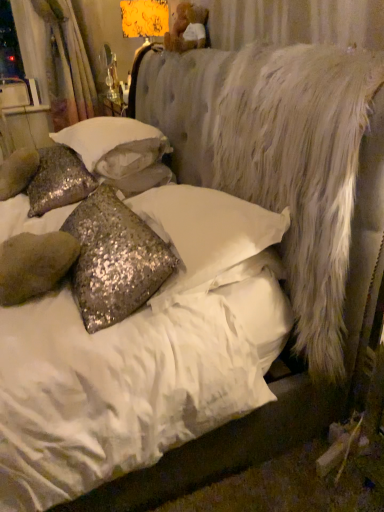
Image resolution: width=384 pixels, height=512 pixels. In order to click on sparkly silver pillow at left, arranged as the third pillow when viewed from the front in this screenshot , I will do `click(58, 180)`.

Locate an element on the screen. The image size is (384, 512). white fluffy mattress at right is located at coordinates (277, 155).

This screenshot has height=512, width=384. What do you see at coordinates (115, 145) in the screenshot?
I see `white sequined pillow at center, which is the second pillow in back-to-front order` at bounding box center [115, 145].

Identify the location of white textured curtain at upper left. (60, 60).

This screenshot has width=384, height=512. Find the location of `silver sequined pillow at center, the first pillow in the front-to-back sequence`. silver sequined pillow at center, the first pillow in the front-to-back sequence is located at coordinates (209, 236).

Locate an element on the screen. The image size is (384, 512). sparkly silver pillow at left, marked as the 1th pillow in a back-to-front arrangement is located at coordinates (58, 180).

Does white textured curtain at upper left appear on the left side of silver sequined pillow at center, the first pillow in the front-to-back sequence?

Yes, white textured curtain at upper left is to the left of silver sequined pillow at center, the first pillow in the front-to-back sequence.

In the scene shown: From a real-world perspective, who is located lower, white textured curtain at upper left or silver sequined pillow at center, arranged as the 3th pillow when viewed from the back?

In real-world perspective, silver sequined pillow at center, arranged as the 3th pillow when viewed from the back, is lower.

From the image's perspective, is white textured curtain at upper left located beneath silver sequined pillow at center, the first pillow in the front-to-back sequence?

No, from the image's perspective, white textured curtain at upper left is not beneath silver sequined pillow at center, the first pillow in the front-to-back sequence.

Is white fluffy mattress at right looking in the opposite direction of sparkly silver pillow at left, arranged as the third pillow when viewed from the front?

No.

Does white fluffy mattress at right lie behind sparkly silver pillow at left, arranged as the third pillow when viewed from the front?

No, white fluffy mattress at right is closer to the camera.

From the picture: From the image's perspective, who appears lower, white fluffy mattress at right or sparkly silver pillow at left, marked as the 1th pillow in a back-to-front arrangement?

From the image's view, white fluffy mattress at right is below.

Which is more to the right, white fluffy mattress at right or sparkly silver pillow at left, arranged as the third pillow when viewed from the front?

Positioned to the right is white fluffy mattress at right.

Is white sequined pillow at center, positioned as the 2th pillow in front-to-back order, thinner than silver sequined pillow at center, arranged as the 3th pillow when viewed from the back?

Incorrect, the width of white sequined pillow at center, positioned as the 2th pillow in front-to-back order, is not less than that of silver sequined pillow at center, arranged as the 3th pillow when viewed from the back.

Which object is further away from the camera, white sequined pillow at center, which is the second pillow in back-to-front order, or silver sequined pillow at center, the first pillow in the front-to-back sequence?

white sequined pillow at center, which is the second pillow in back-to-front order, is more distant.

From the image's perspective, which one is positioned lower, white sequined pillow at center, which is the second pillow in back-to-front order, or silver sequined pillow at center, the first pillow in the front-to-back sequence?

silver sequined pillow at center, the first pillow in the front-to-back sequence, from the image's perspective.

In the scene shown: Considering the sizes of white sequined pillow at center, which is the second pillow in back-to-front order, and white fluffy mattress at right in the image, is white sequined pillow at center, which is the second pillow in back-to-front order, wider or thinner than white fluffy mattress at right?

In the image, white sequined pillow at center, which is the second pillow in back-to-front order, appears to be wider than white fluffy mattress at right.

Can you confirm if white sequined pillow at center, which is the second pillow in back-to-front order, is taller than white fluffy mattress at right?

No.

Does white sequined pillow at center, which is the second pillow in back-to-front order, turn towards white fluffy mattress at right?

No.

Is white textured curtain at upper left oriented away from white fluffy mattress at right?

That's not correct — white textured curtain at upper left is not looking away from white fluffy mattress at right.

From the image's perspective, which one is positioned higher, white textured curtain at upper left or white fluffy mattress at right?

white textured curtain at upper left appears higher in the image.

In the scene shown: Which is more to the right, white textured curtain at upper left or white fluffy mattress at right?

white fluffy mattress at right.

Based on the photo, considering the relative sizes of sparkly silver pillow at left, marked as the 1th pillow in a back-to-front arrangement, and white sequined pillow at center, which is the second pillow in back-to-front order, in the image provided, is sparkly silver pillow at left, marked as the 1th pillow in a back-to-front arrangement, smaller than white sequined pillow at center, which is the second pillow in back-to-front order,?

Yes, sparkly silver pillow at left, marked as the 1th pillow in a back-to-front arrangement, is smaller than white sequined pillow at center, which is the second pillow in back-to-front order.

Where is `the 1st pillow counting from the right of the sparkly silver pillow at left, marked as the 1th pillow in a back-to-front arrangement`? The width and height of the screenshot is (384, 512). the 1st pillow counting from the right of the sparkly silver pillow at left, marked as the 1th pillow in a back-to-front arrangement is located at coordinates (115, 145).

Would you say sparkly silver pillow at left, marked as the 1th pillow in a back-to-front arrangement, is outside white sequined pillow at center, positioned as the 2th pillow in front-to-back order?

Yes, sparkly silver pillow at left, marked as the 1th pillow in a back-to-front arrangement, is outside of white sequined pillow at center, positioned as the 2th pillow in front-to-back order.

Is sparkly silver pillow at left, marked as the 1th pillow in a back-to-front arrangement, to the right of white sequined pillow at center, positioned as the 2th pillow in front-to-back order, from the viewer's perspective?

No.

Who is bigger, silver sequined pillow at center, arranged as the 3th pillow when viewed from the back, or white textured curtain at upper left?

white textured curtain at upper left is bigger.

Is white textured curtain at upper left at the back of silver sequined pillow at center, the first pillow in the front-to-back sequence?

No, white textured curtain at upper left is not at the back of silver sequined pillow at center, the first pillow in the front-to-back sequence.

Is silver sequined pillow at center, arranged as the 3th pillow when viewed from the back, positioned before white textured curtain at upper left?

Yes, silver sequined pillow at center, arranged as the 3th pillow when viewed from the back, is closer to the viewer.

Does silver sequined pillow at center, the first pillow in the front-to-back sequence, have a lesser height compared to white textured curtain at upper left?

Correct, silver sequined pillow at center, the first pillow in the front-to-back sequence, is not as tall as white textured curtain at upper left.

Locate an element on the screen. The image size is (384, 512). curtain on the left of silver sequined pillow at center, arranged as the 3th pillow when viewed from the back is located at coordinates (60, 60).

Locate an element on the screen. Image resolution: width=384 pixels, height=512 pixels. pillow that is the 2nd one below the white fluffy mattress at right (from a real-world perspective) is located at coordinates (58, 180).

Based on their spatial positions, is white fluffy mattress at right or white textured curtain at upper left closer to silver sequined pillow at center, arranged as the 3th pillow when viewed from the back?

Based on the image, white fluffy mattress at right appears to be nearer to silver sequined pillow at center, arranged as the 3th pillow when viewed from the back.

Based on their spatial positions, is white sequined pillow at center, positioned as the 2th pillow in front-to-back order, or silver sequined pillow at center, the first pillow in the front-to-back sequence, further from white textured curtain at upper left?

Based on the image, silver sequined pillow at center, the first pillow in the front-to-back sequence, appears to be further to white textured curtain at upper left.

When comparing their distances from white fluffy mattress at right, does white sequined pillow at center, positioned as the 2th pillow in front-to-back order, or silver sequined pillow at center, arranged as the 3th pillow when viewed from the back, seem closer?

silver sequined pillow at center, arranged as the 3th pillow when viewed from the back, is positioned closer to the anchor white fluffy mattress at right.

Consider the image. Estimate the real-world distances between objects in this image. Which object is further from white sequined pillow at center, which is the second pillow in back-to-front order, sparkly silver pillow at left, marked as the 1th pillow in a back-to-front arrangement, or white fluffy mattress at right?

white fluffy mattress at right is positioned further to the anchor white sequined pillow at center, which is the second pillow in back-to-front order.

From the image, which object appears to be nearer to white sequined pillow at center, positioned as the 2th pillow in front-to-back order, silver sequined pillow at center, the first pillow in the front-to-back sequence, or white textured curtain at upper left?

silver sequined pillow at center, the first pillow in the front-to-back sequence.

Based on their spatial positions, is silver sequined pillow at center, the first pillow in the front-to-back sequence, or white fluffy mattress at right further from white textured curtain at upper left?

The object further to white textured curtain at upper left is silver sequined pillow at center, the first pillow in the front-to-back sequence.

Which object lies further to the anchor point white textured curtain at upper left, silver sequined pillow at center, the first pillow in the front-to-back sequence, or white sequined pillow at center, which is the second pillow in back-to-front order?

Based on the image, silver sequined pillow at center, the first pillow in the front-to-back sequence, appears to be further to white textured curtain at upper left.

Looking at the image, which one is located closer to sparkly silver pillow at left, arranged as the third pillow when viewed from the front, white textured curtain at upper left or white sequined pillow at center, positioned as the 2th pillow in front-to-back order?

Based on the image, white sequined pillow at center, positioned as the 2th pillow in front-to-back order, appears to be nearer to sparkly silver pillow at left, arranged as the third pillow when viewed from the front.

The height and width of the screenshot is (512, 384). In order to click on pillow between silver sequined pillow at center, the first pillow in the front-to-back sequence, and sparkly silver pillow at left, marked as the 1th pillow in a back-to-front arrangement, from front to back in this screenshot , I will do `click(115, 145)`.

Identify the location of pillow located between white sequined pillow at center, which is the second pillow in back-to-front order, and white textured curtain at upper left in the depth direction. (58, 180).

Locate an element on the screen. Image resolution: width=384 pixels, height=512 pixels. pillow located between white fluffy mattress at right and white sequined pillow at center, positioned as the 2th pillow in front-to-back order, in the depth direction is located at coordinates (209, 236).